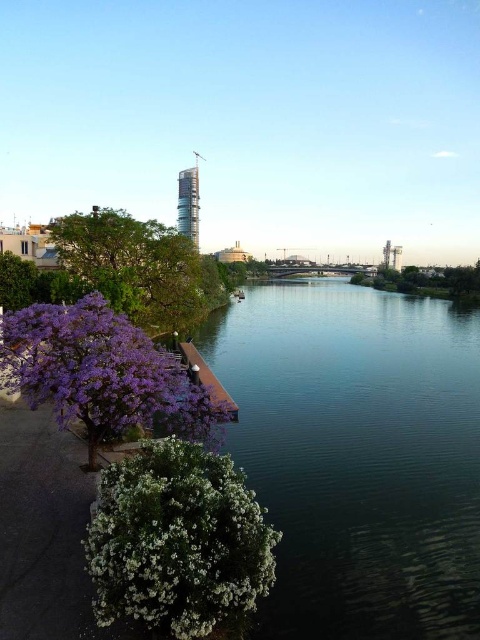
You are a gardener who wants to plant a new bush in the riverside area. You have a small space available. Which of the two plants, the white fluffy bush at lower left or the green leafy tree at left, would be more suitable for the space?

The white fluffy bush at lower left has a smaller size compared to the green leafy tree at left, so it would be more suitable for the small space available.

You are standing at the riverside and want to take a photo of both the purple flowering tree and the white flower bush. The purple flowering tree is located at point (450,324) and the white flower bush is at point (204,308). Which point should you focus on first to ensure both are in the frame?

You should focus on point (450,324) first because it is closer to the camera than point (204,308), ensuring both points are within the frame.